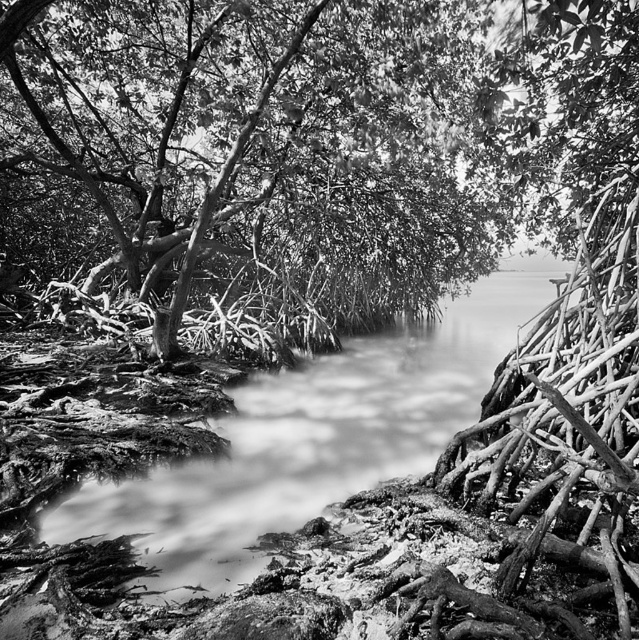
Is smooth bark tree at center smaller than smooth mud stream at center?

No, smooth bark tree at center is not smaller than smooth mud stream at center.

Describe the element at coordinates (323, 140) in the screenshot. This screenshot has width=639, height=640. I see `smooth bark tree at center` at that location.

In order to click on smooth bark tree at center in this screenshot , I will do `click(323, 140)`.